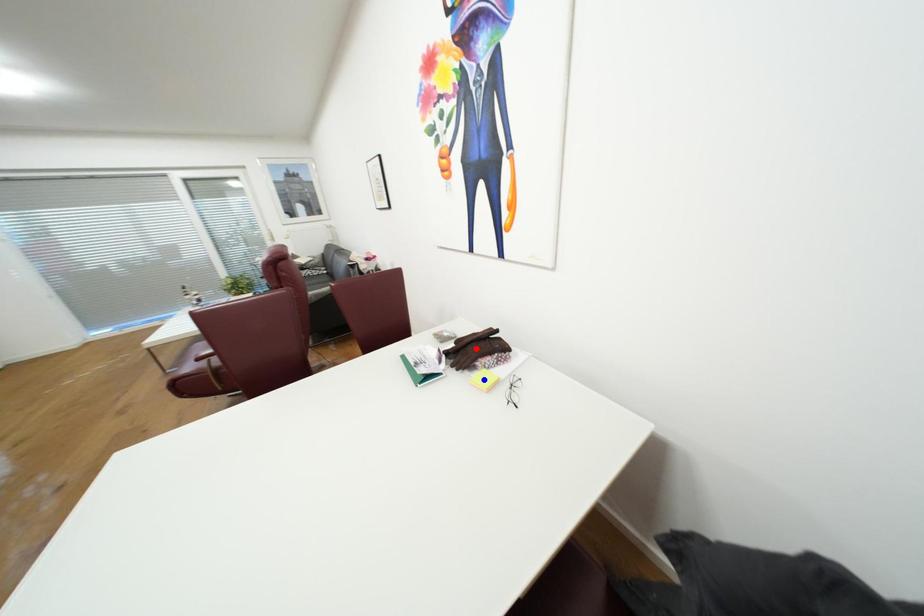
Question: In the image, two points are highlighted. Which point is nearer to the camera? Reply with the corresponding letter.

Choices:
 (A) blue point
 (B) red point

Answer: (A)